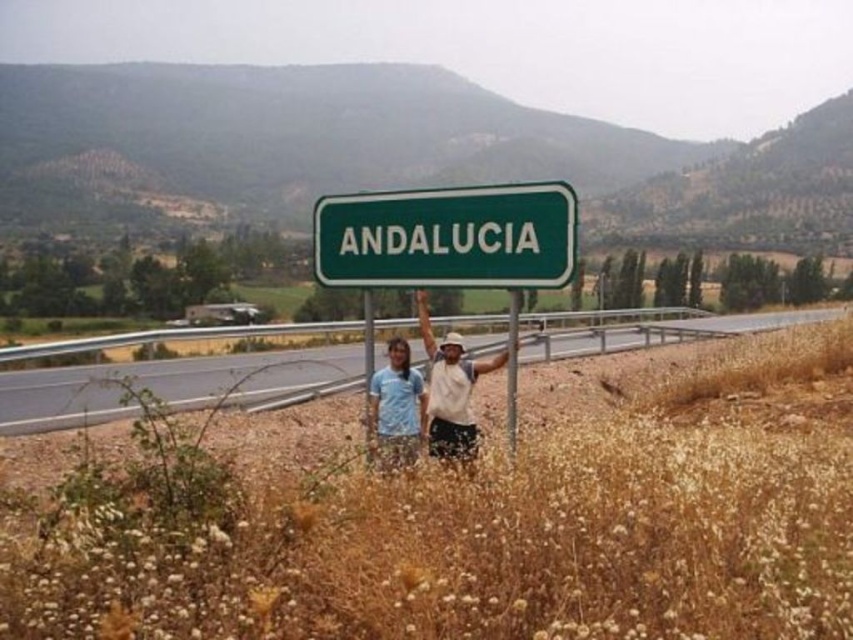
Question: Does gray asphalt highway at center appear under green metallic signpost at center?

Choices:
 (A) yes
 (B) no

Answer: (B)

Question: Which of the following is the farthest from the observer?

Choices:
 (A) (456, 388)
 (B) (509, 451)
 (C) (566, 212)

Answer: (A)

Question: Does white cotton shirt at center have a lesser width compared to green metallic signpost at center?

Choices:
 (A) yes
 (B) no

Answer: (A)

Question: Which point is farther to the camera?

Choices:
 (A) (515, 426)
 (B) (369, 317)
 (C) (0, 408)

Answer: (C)

Question: Among these points, which one is nearest to the camera?

Choices:
 (A) (401, 435)
 (B) (505, 426)
 (C) (440, 368)

Answer: (A)

Question: Can you confirm if gray asphalt highway at center is positioned above blue fabric pants at center?

Choices:
 (A) no
 (B) yes

Answer: (B)